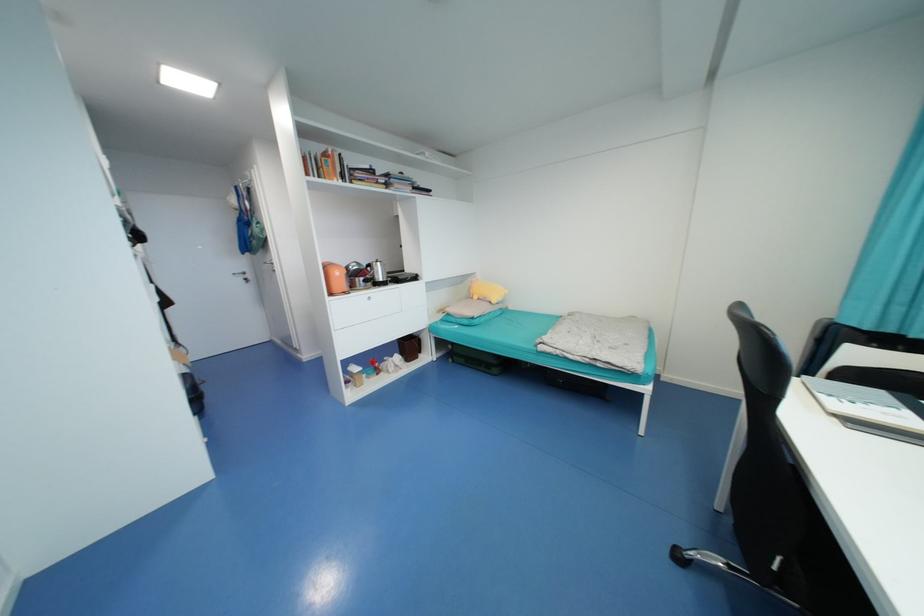
Locate an element on the screen. orange kettle is located at coordinates (334, 278).